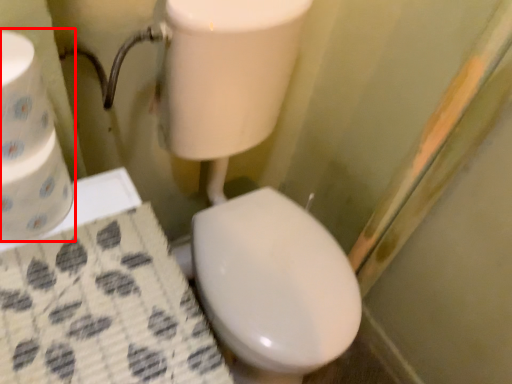
Question: Where is toilet paper (annotated by the red box) located in relation to toilet paper in the image?

Choices:
 (A) right
 (B) left

Answer: (B)